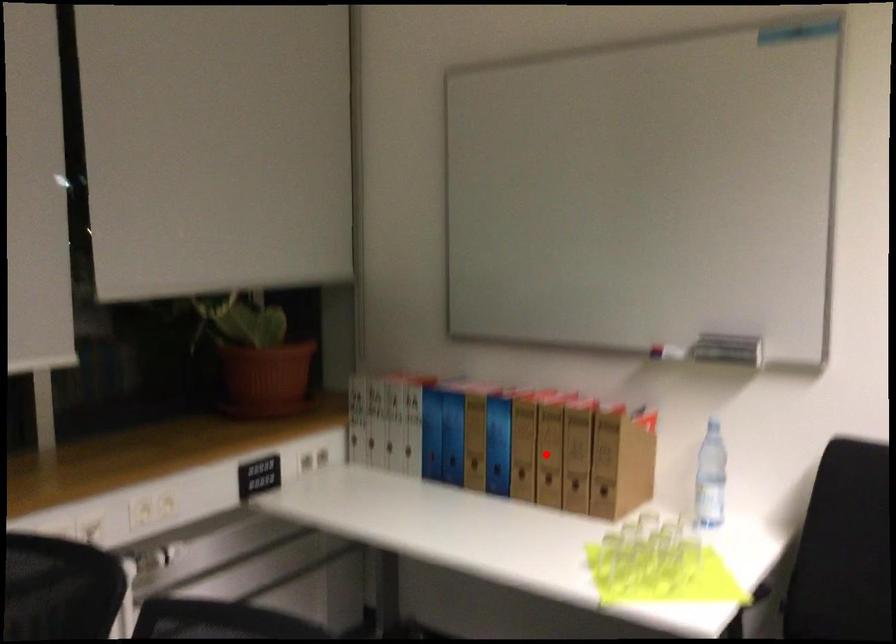
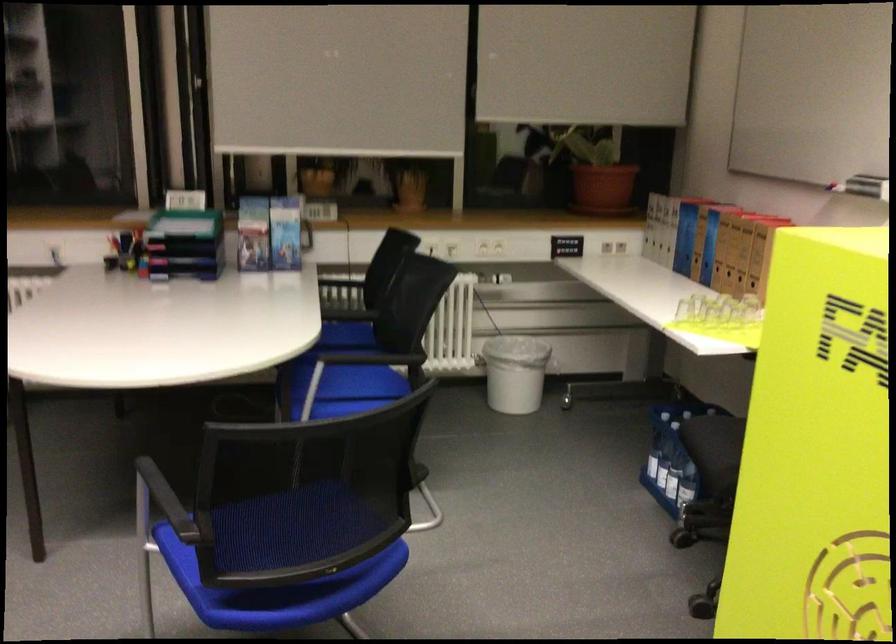
In the second image, find the point that corresponds to the highlighted location in the first image.

(730, 251)